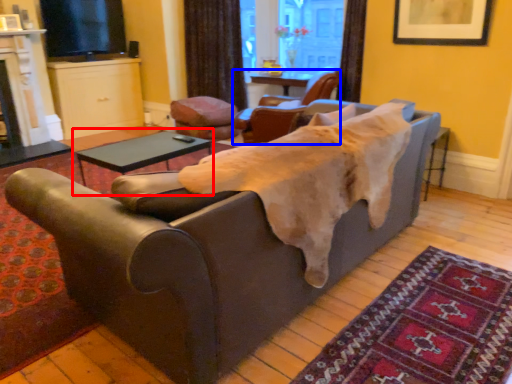
Question: Which point is closer to the camera, table (highlighted by a red box) or chair (highlighted by a blue box)?

Choices:
 (A) table
 (B) chair

Answer: (A)